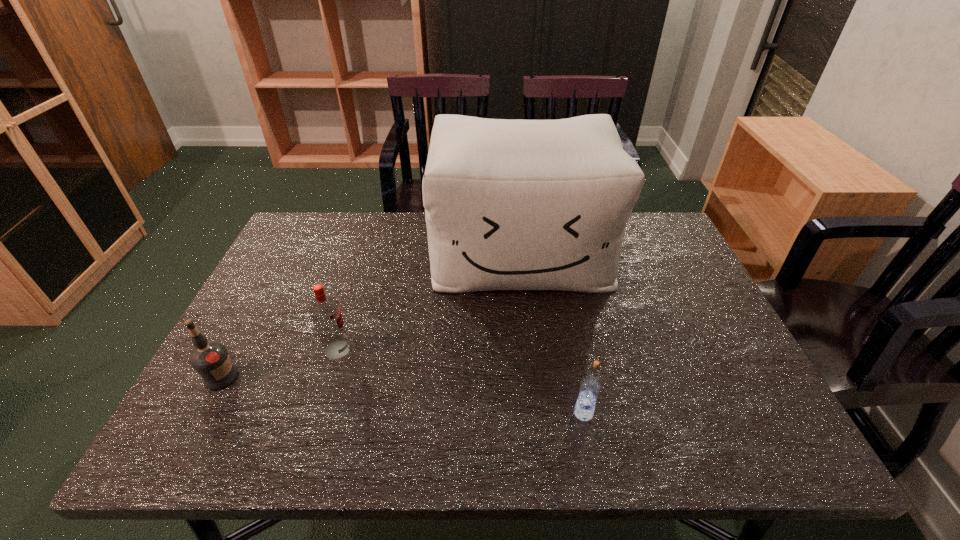
Identify the location of vacant region that satisfies the following two spatial constraints: 1. on the front label of the leftmost vodka; 2. on the left side of the rightmost vodka. (203, 413).

This screenshot has width=960, height=540. I want to click on vacant area that satisfies the following two spatial constraints: 1. on the side of the tallest object with the smiley face; 2. on the front label of the second nearest vodka, so click(x=535, y=377).

This screenshot has height=540, width=960. Identify the location of blank area in the image that satisfies the following two spatial constraints: 1. on the side of the cushion with the smiley face; 2. on the right side of the rightmost vodka. (539, 413).

Image resolution: width=960 pixels, height=540 pixels. I want to click on free location that satisfies the following two spatial constraints: 1. on the back side of the rightmost vodka; 2. on the front label of the leftmost object, so click(576, 377).

Image resolution: width=960 pixels, height=540 pixels. Find the location of `vacant region that satisfies the following two spatial constraints: 1. on the side of the farthest object with the smiley face; 2. on the front label of the second nearest object`. vacant region that satisfies the following two spatial constraints: 1. on the side of the farthest object with the smiley face; 2. on the front label of the second nearest object is located at coordinates (535, 377).

Identify the location of vacant space that satisfies the following two spatial constraints: 1. on the front label of the nearest object; 2. on the right side of the leftmost vodka. (203, 413).

Locate an element on the screen. free space that satisfies the following two spatial constraints: 1. on the front label of the second nearest vodka; 2. on the left side of the nearest vodka is located at coordinates (203, 413).